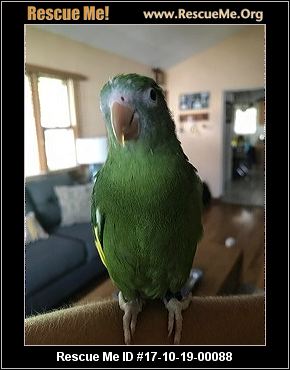
Identify the location of couch cushions. (59, 242), (77, 232).